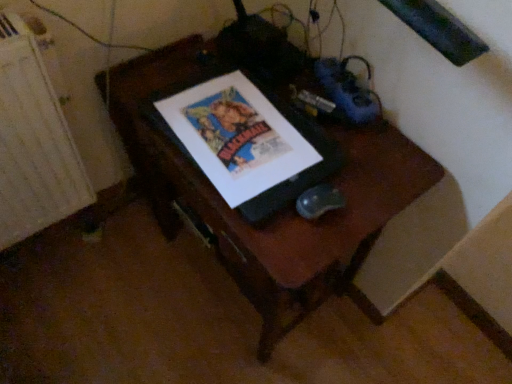
Question: Is matte paper poster at center shorter than white textured radiator at left?

Choices:
 (A) yes
 (B) no

Answer: (A)

Question: Considering the relative sizes of matte paper poster at center and white textured radiator at left in the image provided, is matte paper poster at center thinner than white textured radiator at left?

Choices:
 (A) no
 (B) yes

Answer: (A)

Question: Does matte paper poster at center have a greater width compared to white textured radiator at left?

Choices:
 (A) no
 (B) yes

Answer: (B)

Question: Does matte paper poster at center have a smaller size compared to white textured radiator at left?

Choices:
 (A) no
 (B) yes

Answer: (B)

Question: Can we say matte paper poster at center lies outside white textured radiator at left?

Choices:
 (A) yes
 (B) no

Answer: (A)

Question: Is wooden desk at center inside the boundaries of matte paper poster at center, or outside?

Choices:
 (A) outside
 (B) inside

Answer: (A)

Question: Considering the positions of point click(175, 196) and point click(228, 160), is point click(175, 196) closer or farther from the camera than point click(228, 160)?

Choices:
 (A) farther
 (B) closer

Answer: (A)

Question: Considering their positions, is wooden desk at center located in front of or behind matte paper poster at center?

Choices:
 (A) behind
 (B) front

Answer: (B)

Question: Looking at the image, does wooden desk at center seem bigger or smaller compared to matte paper poster at center?

Choices:
 (A) small
 (B) big

Answer: (B)

Question: Is matte paper poster at center taller or shorter than white textured radiator at left?

Choices:
 (A) short
 (B) tall

Answer: (A)

Question: Is matte paper poster at center in front of or behind white textured radiator at left in the image?

Choices:
 (A) front
 (B) behind

Answer: (B)

Question: Looking at their shapes, would you say matte paper poster at center is wider or thinner than white textured radiator at left?

Choices:
 (A) thin
 (B) wide

Answer: (B)

Question: Is point (265, 175) closer or farther from the camera than point (11, 56)?

Choices:
 (A) closer
 (B) farther

Answer: (A)

Question: Does point (11, 142) appear closer or farther from the camera than point (265, 175)?

Choices:
 (A) farther
 (B) closer

Answer: (A)

Question: Considering the positions of white textured radiator at left and matte paper poster at center in the image, is white textured radiator at left wider or thinner than matte paper poster at center?

Choices:
 (A) wide
 (B) thin

Answer: (B)